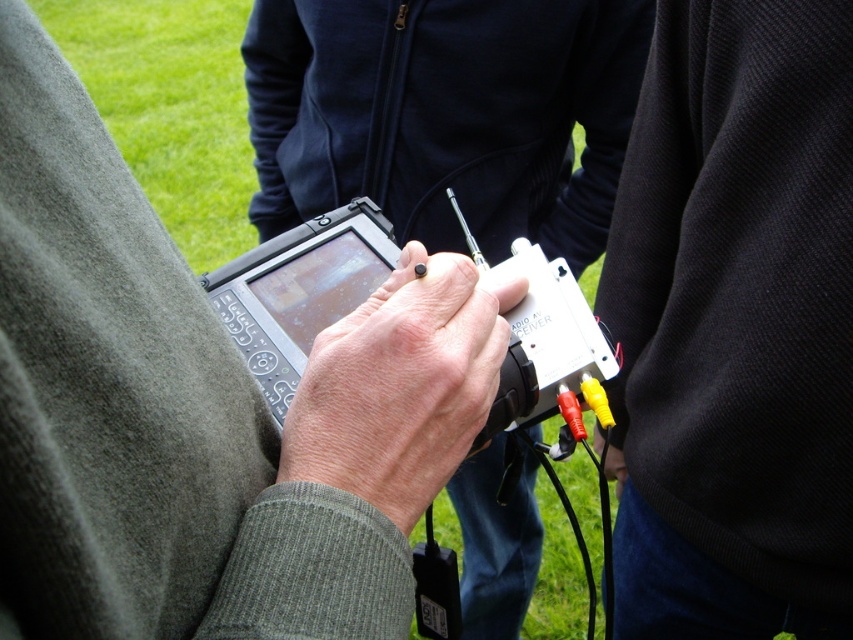
You are setting up an outdoor event and need to ensure the matte black tablet at center can fit into a protective case designed for the black textured sweater at center. Based on their sizes, will the tablet fit into the case?

The matte black tablet at center is wider than the black textured sweater at center, so it will not fit into the case designed for the sweater.

You are trying to determine if the smooth skin hand at center can fully grip the white plastic video camera at center. Based on the provided scene, can the hand fit around the camera?

The smooth skin hand at center has a lesser width compared to the white plastic video camera at center, so the hand may not fully grip the camera due to its smaller width.